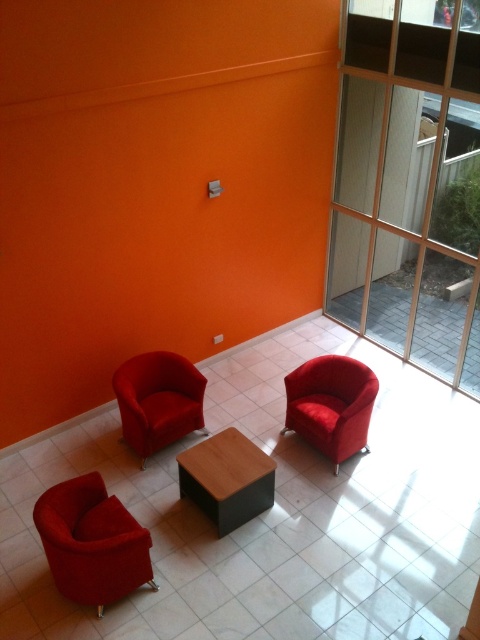
Does matte red armchair at center have a larger size compared to velvet red armchair at center?

Yes.

Does point (345, 378) come closer to viewer compared to point (145, 390)?

Yes, point (345, 378) is in front of point (145, 390).

Who is more forward, [348,436] or [168,378]?

Positioned in front is point [348,436].

Where is `matte red armchair at center`? The height and width of the screenshot is (640, 480). matte red armchair at center is located at coordinates (331, 404).

Does transparent glass door at upper right lie behind velvet red armchair at lower left?

Yes.

Describe the element at coordinates (409, 182) in the screenshot. I see `transparent glass door at upper right` at that location.

Locate an element on the screen. The height and width of the screenshot is (640, 480). transparent glass door at upper right is located at coordinates (409, 182).

The height and width of the screenshot is (640, 480). What do you see at coordinates (157, 401) in the screenshot? I see `velvet red armchair at center` at bounding box center [157, 401].

Which is above, velvet red armchair at center or brown matte stool at center?

velvet red armchair at center is above.

What do you see at coordinates (157, 401) in the screenshot?
I see `velvet red armchair at center` at bounding box center [157, 401].

This screenshot has width=480, height=640. What are the coordinates of `velvet red armchair at center` in the screenshot? It's located at (157, 401).